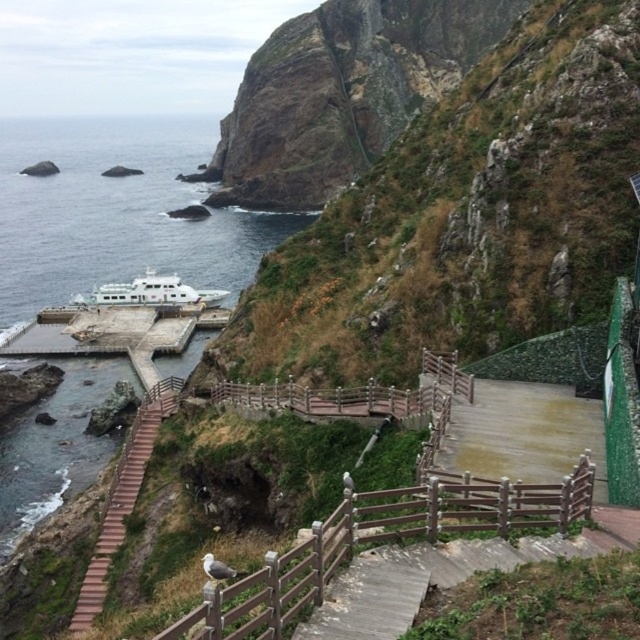
Who is lower down, blue water at lower left or brown wooden rail at center?

brown wooden rail at center is below.

Does blue water at lower left come in front of brown wooden rail at center?

No, it is not.

Which is in front, point (45, 120) or point (438, 486)?

Point (438, 486) is more forward.

Locate an element on the screen. blue water at lower left is located at coordinates (116, 211).

Can you confirm if blue water at lower left is taller than white glossy cruise ship at lower left?

Yes.

Find the location of a particular element. blue water at lower left is located at coordinates tap(116, 211).

Locate an element on the screen. blue water at lower left is located at coordinates (116, 211).

Which is in front, point (458, 109) or point (124, 298)?

Point (458, 109) is in front.

Is green mossy rock at center thinner than white glossy cruise ship at lower left?

No, green mossy rock at center is not thinner than white glossy cruise ship at lower left.

Between point (529, 67) and point (168, 300), which one is positioned behind?

Point (168, 300)

Locate an element on the screen. The height and width of the screenshot is (640, 640). green mossy rock at center is located at coordinates (465, 218).